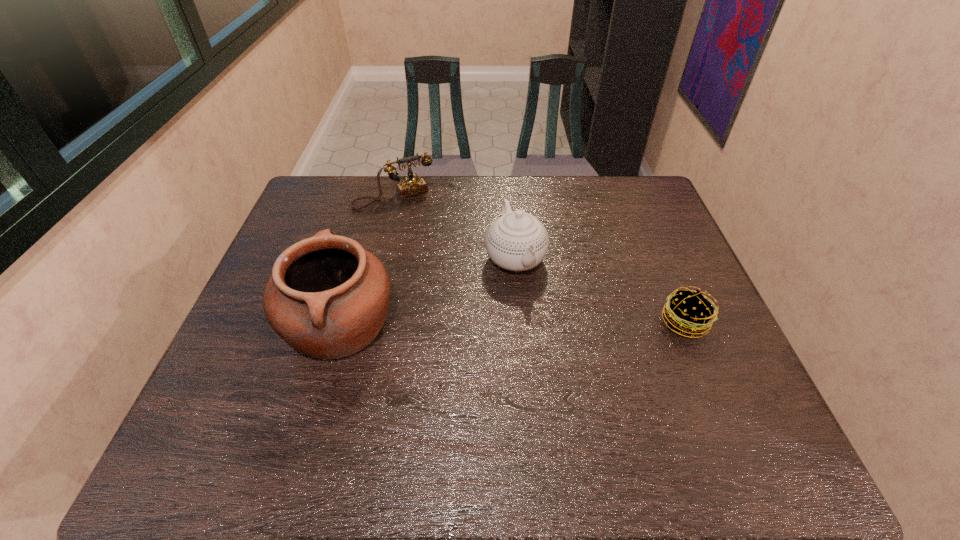
Locate an element on the screen. Image resolution: width=960 pixels, height=540 pixels. free space in the image that satisfies the following two spatial constraints: 1. on the back side of the third tallest object; 2. on the right side of the pottery is located at coordinates (376, 197).